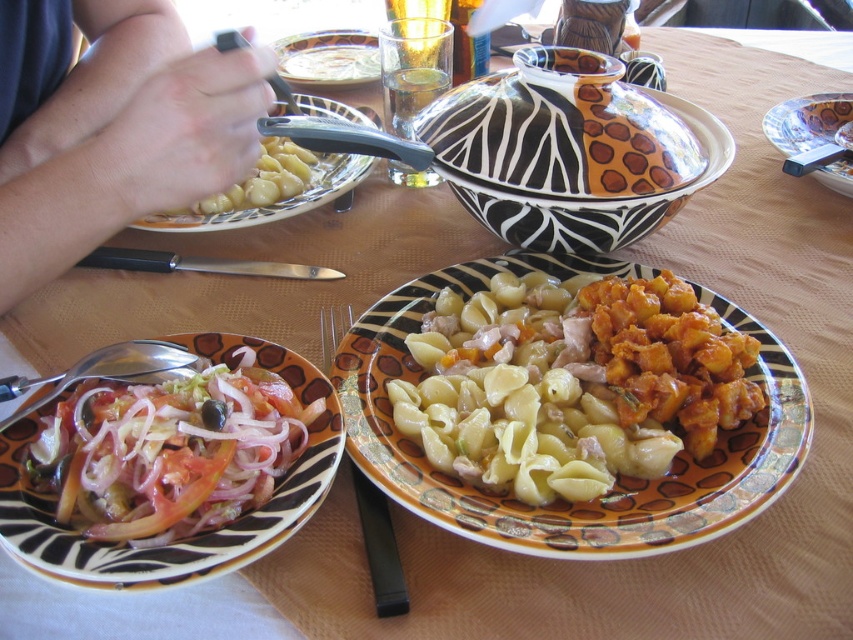
Is matte ceramic salad bowl at lower left to the left of black plastic fork at lower center from the viewer's perspective?

Correct, you'll find matte ceramic salad bowl at lower left to the left of black plastic fork at lower center.

Does matte ceramic salad bowl at lower left lie behind black plastic fork at lower center?

No.

Who is more forward, (x=194, y=554) or (x=376, y=614)?

Point (x=194, y=554)

At what (x,y) coordinates should I click in order to perform the action: click on matte ceramic salad bowl at lower left. Please return your answer as a coordinate pair (x, y). Looking at the image, I should click on (189, 538).

Is matte ceramic plate at upper left positioned in front of porcelain plate at upper right?

Yes, matte ceramic plate at upper left is closer to the viewer.

Can you confirm if matte ceramic plate at upper left is bigger than porcelain plate at upper right?

Yes.

Is point (260, 212) more distant than point (770, 109)?

That is False.

Find the location of a particular element. Image resolution: width=853 pixels, height=640 pixels. matte ceramic plate at upper left is located at coordinates (276, 202).

Is matte ceramic bowl at upper center bigger than porcelain plate at upper right?

No, matte ceramic bowl at upper center is not bigger than porcelain plate at upper right.

Which of these two, matte ceramic bowl at upper center or porcelain plate at upper right, stands shorter?

matte ceramic bowl at upper center

Which is in front, point (297, 67) or point (796, 145)?

Point (796, 145) is in front.

Find the location of a particular element. The height and width of the screenshot is (640, 853). matte ceramic bowl at upper center is located at coordinates (329, 58).